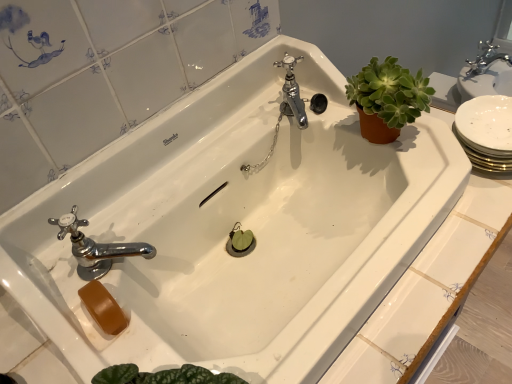
Question: Should I look upward or downward to see green succulent at upper right?

Choices:
 (A) up
 (B) down

Answer: (A)

Question: Does green succulent at upper right have a smaller size compared to chrome metallic faucet at center, the second tap viewed from the left?

Choices:
 (A) yes
 (B) no

Answer: (B)

Question: Considering the relative positions of green succulent at upper right and chrome metallic faucet at center, the first tap viewed from the back, in the image provided, is green succulent at upper right to the right of chrome metallic faucet at center, the first tap viewed from the back, from the viewer's perspective?

Choices:
 (A) no
 (B) yes

Answer: (B)

Question: Does green succulent at upper right touch chrome metallic faucet at center, the 1th tap positioned from the right?

Choices:
 (A) no
 (B) yes

Answer: (A)

Question: Is green succulent at upper right behind chrome metallic faucet at center, the first tap viewed from the back?

Choices:
 (A) yes
 (B) no

Answer: (B)

Question: Does green succulent at upper right contain chrome metallic faucet at center, the 2th tap positioned from the bottom?

Choices:
 (A) no
 (B) yes

Answer: (A)

Question: Considering the relative sizes of green succulent at upper right and chrome metallic faucet at center, the second tap viewed from the left, in the image provided, is green succulent at upper right shorter than chrome metallic faucet at center, the second tap viewed from the left,?

Choices:
 (A) yes
 (B) no

Answer: (B)

Question: Is chrome metallic faucet at lower left, which is the second tap from right to left, oriented away from chrome metallic faucet at center, the 2th tap positioned from the bottom?

Choices:
 (A) no
 (B) yes

Answer: (A)

Question: Is chrome metallic faucet at lower left, the 1th tap in the bottom-to-top sequence, further to camera compared to chrome metallic faucet at center, the 2th tap positioned from the bottom?

Choices:
 (A) yes
 (B) no

Answer: (B)

Question: Can you confirm if chrome metallic faucet at lower left, marked as the second tap in a back-to-front arrangement, is shorter than chrome metallic faucet at center, the 1th tap positioned from the right?

Choices:
 (A) no
 (B) yes

Answer: (B)

Question: Considering the relative sizes of chrome metallic faucet at lower left, marked as the second tap in a back-to-front arrangement, and chrome metallic faucet at center, the first tap viewed from the back, in the image provided, is chrome metallic faucet at lower left, marked as the second tap in a back-to-front arrangement, wider than chrome metallic faucet at center, the first tap viewed from the back,?

Choices:
 (A) yes
 (B) no

Answer: (A)

Question: Is chrome metallic faucet at lower left, marked as the second tap in a back-to-front arrangement, taller than chrome metallic faucet at center, the 1th tap positioned from the top?

Choices:
 (A) yes
 (B) no

Answer: (B)

Question: Is chrome metallic faucet at lower left, marked as the second tap in a back-to-front arrangement, not near chrome metallic faucet at center, the first tap viewed from the back?

Choices:
 (A) no
 (B) yes

Answer: (A)

Question: Is chrome metallic faucet at center, the 1th tap positioned from the right, oriented towards chrome metallic faucet at lower left, which is the second tap from right to left?

Choices:
 (A) yes
 (B) no

Answer: (B)